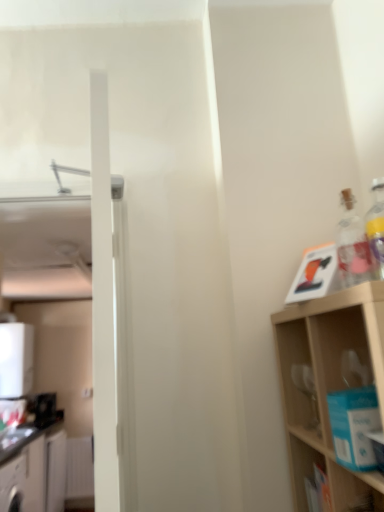
Question: Is black plastic toaster at left, the second appliance when ordered from top to bottom, to the left or to the right of white glossy cabinet at lower left, the second cabinetry when ordered from front to back, in the image?

Choices:
 (A) right
 (B) left

Answer: (B)

Question: From the image's perspective, relative to white glossy cabinet at lower left, the 1th cabinetry viewed from the back, is black plastic toaster at left, arranged as the first appliance when ordered from the bottom, above or below?

Choices:
 (A) below
 (B) above

Answer: (B)

Question: Which is farther from the transparent glass bottle at upper right?

Choices:
 (A) black plastic toaster at left, arranged as the first appliance when ordered from the bottom
 (B) wooden shelf at right
 (C) white glossy cabinet at lower left, the second cabinetry when ordered from front to back
 (D) white glossy water heater at left, positioned as the first appliance in top-to-bottom order
 (E) white glossy cabinet at lower left, the first cabinetry viewed from the front

Answer: (D)

Question: Considering the real-world distances, which object is closest to the transparent glass bottle at upper right?

Choices:
 (A) white glossy water heater at left, positioned as the first appliance in top-to-bottom order
 (B) white glossy cabinet at lower left, which is counted as the second cabinetry, starting from the back
 (C) white glossy cabinet at lower left, the second cabinetry when ordered from front to back
 (D) black plastic toaster at left, the second appliance when ordered from top to bottom
 (E) wooden shelf at right

Answer: (E)